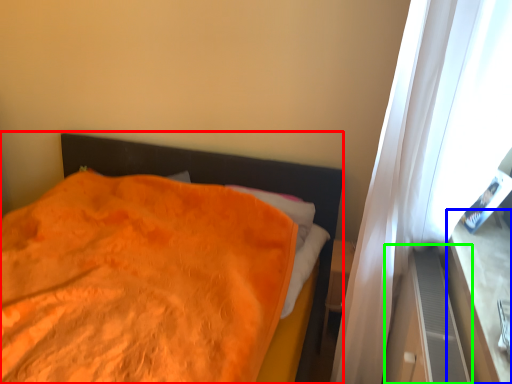
Question: Based on their relative distances, which object is farther from bed (highlighted by a red box)? Choose from window sill (highlighted by a blue box) and dresser (highlighted by a green box).

Choices:
 (A) window sill
 (B) dresser

Answer: (A)